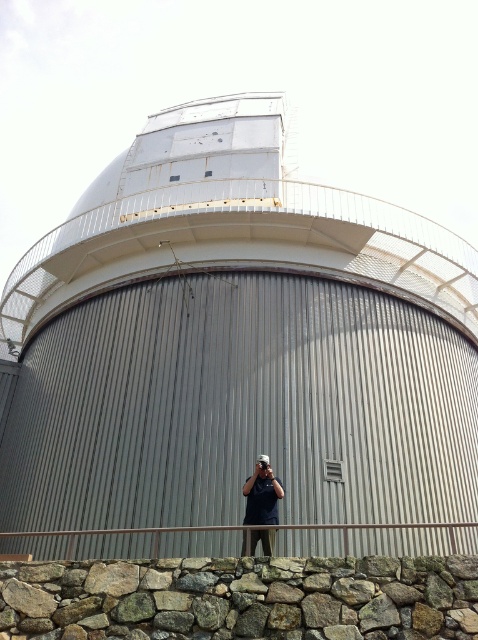
You are standing in front of the observatory and notice both the rusty metal observatory at center and the dark blue shirt at center. Which object is positioned higher from the ground?

The rusty metal observatory at center is above the dark blue shirt at center, so it is positioned higher from the ground.

You are standing in front of the observatory and want to take a photo of the rusty metal observatory at center and the dark blue shirt at center. Which object should you position to your right side to capture both in the frame?

You should position the dark blue shirt at center to your right side because the rusty metal observatory at center is to the left of it, so placing the dark blue shirt at center to your right will keep both in the frame.